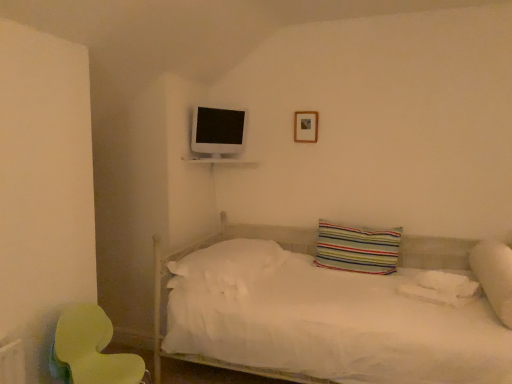
Question: Is white soft pillow at right, which is the third pillow from left to right, placed right next to white glossy shelf at upper center?

Choices:
 (A) no
 (B) yes

Answer: (A)

Question: Is white soft pillow at right, which is the third pillow from left to right, closer to camera compared to white glossy shelf at upper center?

Choices:
 (A) no
 (B) yes

Answer: (B)

Question: Is white soft pillow at right, which is the third pillow from left to right, taller than white glossy shelf at upper center?

Choices:
 (A) yes
 (B) no

Answer: (A)

Question: Does white soft pillow at right, the first pillow in the right-to-left sequence, have a lesser width compared to white glossy shelf at upper center?

Choices:
 (A) yes
 (B) no

Answer: (B)

Question: Is white soft pillow at right, which is the third pillow from left to right, not near white glossy shelf at upper center?

Choices:
 (A) yes
 (B) no

Answer: (A)

Question: Is white soft pillow at right, which is the third pillow from left to right, not inside white glossy shelf at upper center?

Choices:
 (A) yes
 (B) no

Answer: (A)

Question: Is wooden picture frame at upper center facing towards green plastic swivel chair at lower left?

Choices:
 (A) no
 (B) yes

Answer: (A)

Question: Can we say wooden picture frame at upper center lies outside green plastic swivel chair at lower left?

Choices:
 (A) yes
 (B) no

Answer: (A)

Question: Can you confirm if wooden picture frame at upper center is thinner than green plastic swivel chair at lower left?

Choices:
 (A) yes
 (B) no

Answer: (A)

Question: Considering the relative positions of wooden picture frame at upper center and green plastic swivel chair at lower left in the image provided, is wooden picture frame at upper center to the left of green plastic swivel chair at lower left from the viewer's perspective?

Choices:
 (A) yes
 (B) no

Answer: (B)

Question: Does wooden picture frame at upper center touch green plastic swivel chair at lower left?

Choices:
 (A) yes
 (B) no

Answer: (B)

Question: From the image's perspective, would you say wooden picture frame at upper center is shown under green plastic swivel chair at lower left?

Choices:
 (A) no
 (B) yes

Answer: (A)

Question: Is white glossy shelf at upper center behind white soft pillow at right, the first pillow in the right-to-left sequence?

Choices:
 (A) yes
 (B) no

Answer: (A)